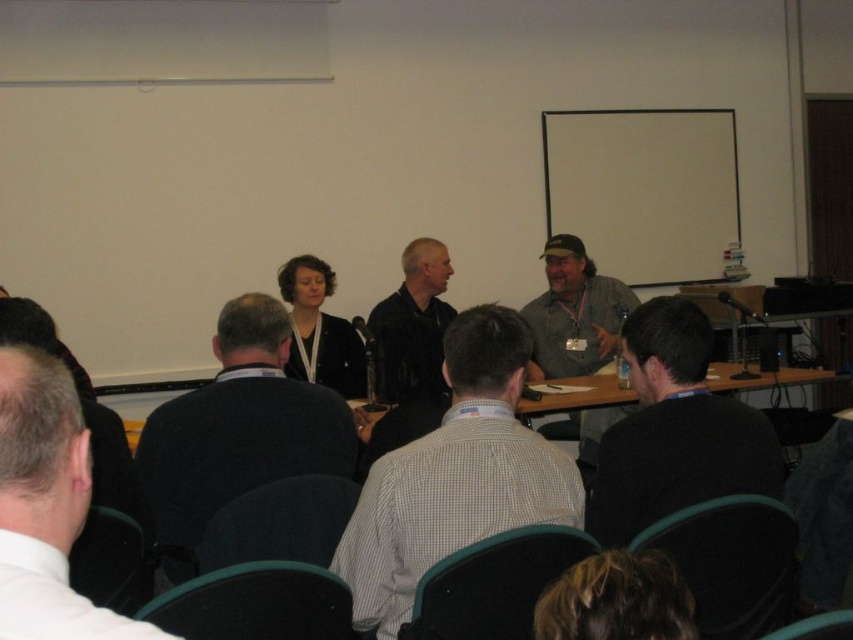
You are an event organizer and need to adjust seating arrangements. You see the white checkered shirt at center and the dark blue sweater at center. Which one is sitting in front of the other?

The white checkered shirt at center is positioned over dark blue sweater at center, meaning the white checkered shirt at center is sitting in front of the dark blue sweater at center.

You are attending a conference and need to locate the speaker who is wearing a black matte shirt at lower right. Where is this speaker in relation to the wooden table at center?

The black matte shirt at lower right is above the wooden table at center.

From the picture: You are sitting in the conference room and want to hand a document to the person wearing the black matte shirt at lower right. You have to walk from your current position near the wooden table at center. Which direction should you move to reach them?

The black matte shirt at lower right is closer to the viewer than the wooden table at center, so you should move towards the lower right direction to reach them.